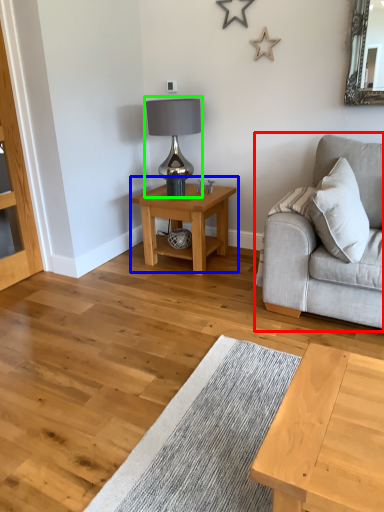
Question: Which object is the farthest from studio couch (highlighted by a red box)? Choose among these: table (highlighted by a blue box) or table lamp (highlighted by a green box).

Choices:
 (A) table
 (B) table lamp

Answer: (B)